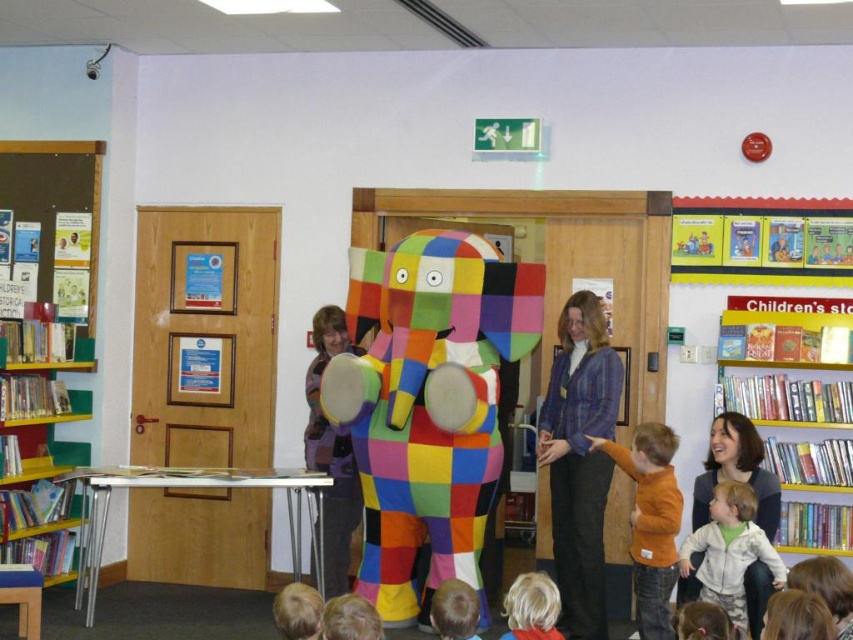
You are observing a group of people in the storytelling area. There are two individuals with blonde hair at lower center and smooth brown hair at lower center. Which person is standing closer to the ground?

The blonde hair at lower center is positioned under smooth brown hair at lower center, so the person with blonde hair at lower center is standing closer to the ground.

You are a photographer standing in the storytelling area. You want to take a photo of the multicolored fabric elephant at center and the smooth brown hair at lower center. Which object should you focus on first if you want to capture both in one shot without moving the camera?

The multicolored fabric elephant at center is located above the smooth brown hair at lower center, so you should focus on the multicolored fabric elephant at center first to ensure both are in the frame.

You are a photographer at the storytelling event. You want to take a photo of the two people with blonde hair at lower center and smooth brown hair at lower center. Which person should you focus on first to ensure they are in the foreground?

You should focus on the blonde hair at lower center first because the smooth brown hair at lower center is behind it, so the blonde hair at lower center is closer to the camera and will be in the foreground.